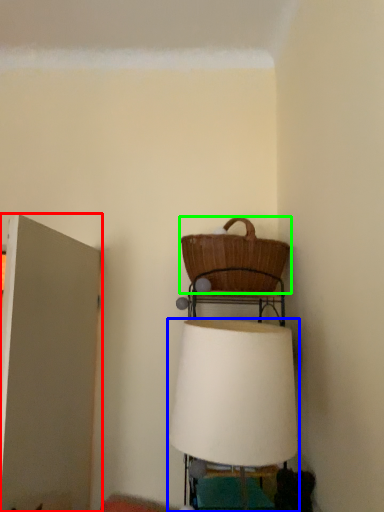
Question: Which object is the farthest from door (highlighted by a red box)? Choose among these: lamp (highlighted by a blue box) or picnic basket (highlighted by a green box).

Choices:
 (A) lamp
 (B) picnic basket

Answer: (A)